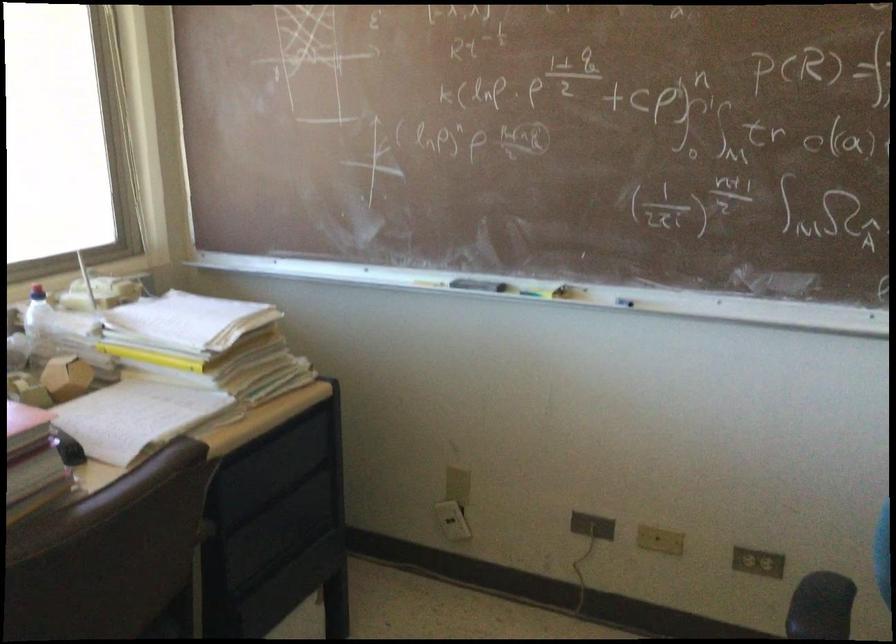
Where is `black marker`? black marker is located at coordinates (626, 304).